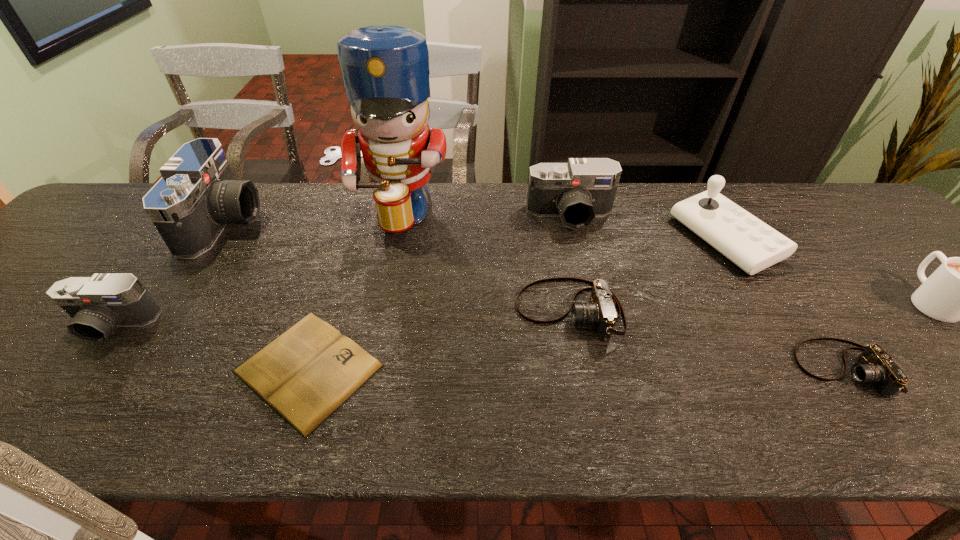
The height and width of the screenshot is (540, 960). Find the location of `the bigger brown camera`. the bigger brown camera is located at coordinates (600, 311).

The height and width of the screenshot is (540, 960). I want to click on the smaller brown camera, so click(x=875, y=365).

Identify the location of the shortest camera. This screenshot has height=540, width=960. (875, 365).

Find the location of `the shortest object`. the shortest object is located at coordinates (305, 374).

Image resolution: width=960 pixels, height=540 pixels. Find the location of `free space located 0.230m on the front-facing side of the tallest object`. free space located 0.230m on the front-facing side of the tallest object is located at coordinates (369, 311).

Identify the location of vacant space positioned on the front-facing side of the eighth shortest object. This screenshot has height=540, width=960. (380, 222).

Identify the location of vacant space located on the front of the joystick. (833, 417).

At what (x,y) coordinates should I click in order to perform the action: click on vacant space located on the front-facing side of the rightmost black camera. Please return your answer as a coordinate pair (x, y). The height and width of the screenshot is (540, 960). Looking at the image, I should click on (585, 279).

Find the location of a particular element. free point located 0.140m on the front-facing side of the smallest black camera is located at coordinates (52, 406).

The height and width of the screenshot is (540, 960). What are the coordinates of `free space located on the front-facing side of the third shortest object` in the screenshot? It's located at (429, 310).